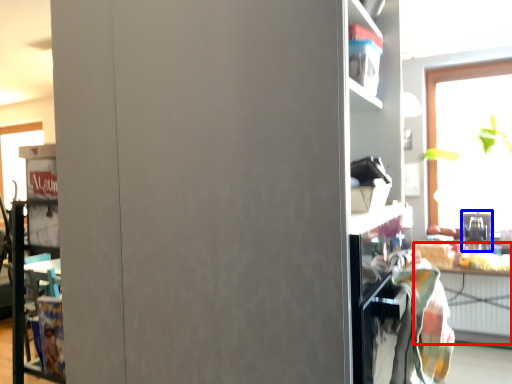
Question: Which object appears farthest to the camera in this image, table (highlighted by a red box) or appliance (highlighted by a blue box)?

Choices:
 (A) table
 (B) appliance

Answer: (B)